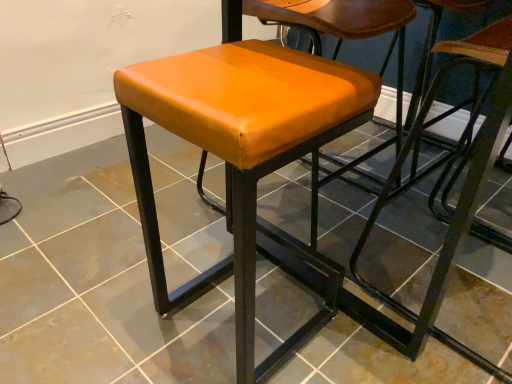
Where is `free space underneath orange leather stool at center (from a real-world perspective)`? The image size is (512, 384). free space underneath orange leather stool at center (from a real-world perspective) is located at coordinates (231, 328).